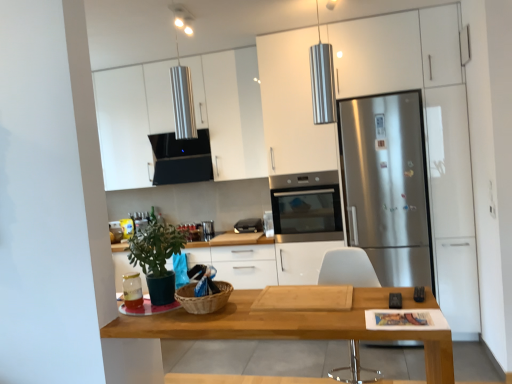
Image resolution: width=512 pixels, height=384 pixels. What are the coordinates of `vacant space situated on the left part of black plastic remote control at lower center, marked as the 1th appliance in a front-to-back arrangement` in the screenshot? It's located at (350, 308).